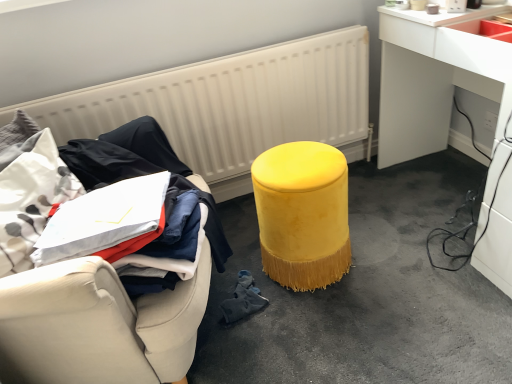
Question: Is the position of velvet yellow stool at center more distant than that of white textured radiator at upper center?

Choices:
 (A) no
 (B) yes

Answer: (A)

Question: Can you confirm if velvet yellow stool at center is smaller than white textured radiator at upper center?

Choices:
 (A) yes
 (B) no

Answer: (A)

Question: Is velvet yellow stool at center located outside white textured radiator at upper center?

Choices:
 (A) yes
 (B) no

Answer: (A)

Question: Is velvet yellow stool at center in front of white textured radiator at upper center?

Choices:
 (A) no
 (B) yes

Answer: (B)

Question: Can you confirm if velvet yellow stool at center is positioned to the right of white textured radiator at upper center?

Choices:
 (A) yes
 (B) no

Answer: (A)

Question: In terms of width, does white textured radiator at upper center look wider or thinner when compared to black fabric at left?

Choices:
 (A) thin
 (B) wide

Answer: (A)

Question: From a real-world perspective, is white textured radiator at upper center positioned above or below black fabric at left?

Choices:
 (A) below
 (B) above

Answer: (A)

Question: From the image's perspective, is white textured radiator at upper center located above or below black fabric at left?

Choices:
 (A) above
 (B) below

Answer: (A)

Question: Is white textured radiator at upper center bigger or smaller than black fabric at left?

Choices:
 (A) big
 (B) small

Answer: (A)

Question: Considering the positions of point (459, 312) and point (20, 258), is point (459, 312) closer or farther from the camera than point (20, 258)?

Choices:
 (A) closer
 (B) farther

Answer: (B)

Question: Would you say velvet yellow stool at center is to the left or to the right of velvet yellow stool at center in the picture?

Choices:
 (A) right
 (B) left

Answer: (A)

Question: Which is correct: velvet yellow stool at center is inside velvet yellow stool at center, or outside of it?

Choices:
 (A) outside
 (B) inside

Answer: (A)

Question: In terms of size, does velvet yellow stool at center appear bigger or smaller than velvet yellow stool at center?

Choices:
 (A) small
 (B) big

Answer: (A)

Question: Relative to white textured radiator at upper center, is black fabric at left in front or behind?

Choices:
 (A) behind
 (B) front

Answer: (B)

Question: In terms of size, does black fabric at left appear bigger or smaller than white textured radiator at upper center?

Choices:
 (A) big
 (B) small

Answer: (B)